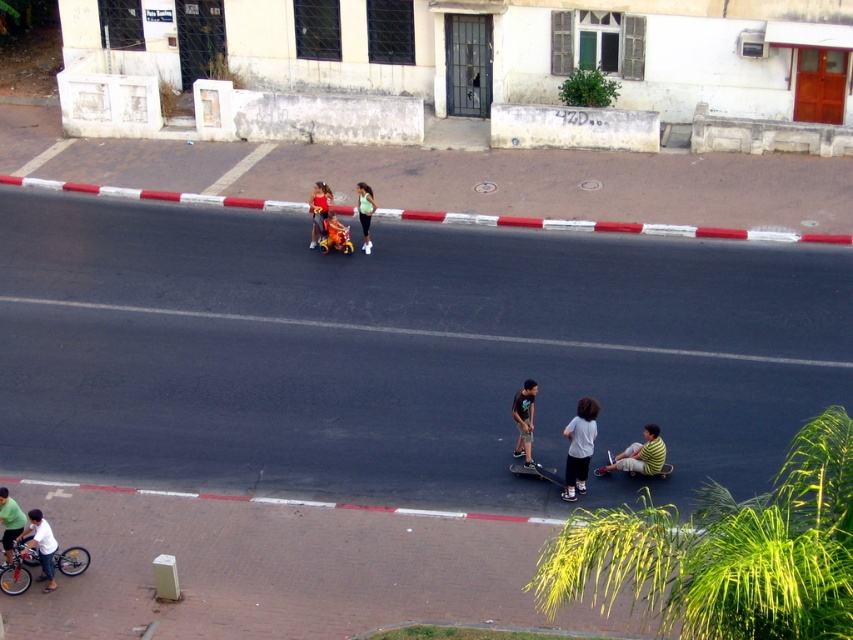
Is metallic silver baby carriage at center positioned in front of black smooth skateboard at center?

No, it is not.

At what (x,y) coordinates should I click in order to perform the action: click on metallic silver baby carriage at center. Please return your answer as a coordinate pair (x, y). The width and height of the screenshot is (853, 640). Looking at the image, I should click on (335, 236).

Find the location of `metallic silver baby carriage at center`. metallic silver baby carriage at center is located at coordinates (335, 236).

Does point (44, 564) lie behind point (364, 216)?

No, (44, 564) is closer to viewer.

Does white matte bicycle at lower left appear on the left side of green matte shirt at center?

Indeed, white matte bicycle at lower left is positioned on the left side of green matte shirt at center.

At what (x,y) coordinates should I click in order to perform the action: click on white matte bicycle at lower left. Please return your answer as a coordinate pair (x, y). The width and height of the screenshot is (853, 640). Looking at the image, I should click on (39, 545).

Between yellow striped shirt at lower right and matte red scooter at center, which one appears on the left side from the viewer's perspective?

From the viewer's perspective, matte red scooter at center appears more on the left side.

Is yellow striped shirt at lower right wider than matte red scooter at center?

Correct, the width of yellow striped shirt at lower right exceeds that of matte red scooter at center.

The height and width of the screenshot is (640, 853). What are the coordinates of `yellow striped shirt at lower right` in the screenshot? It's located at (639, 454).